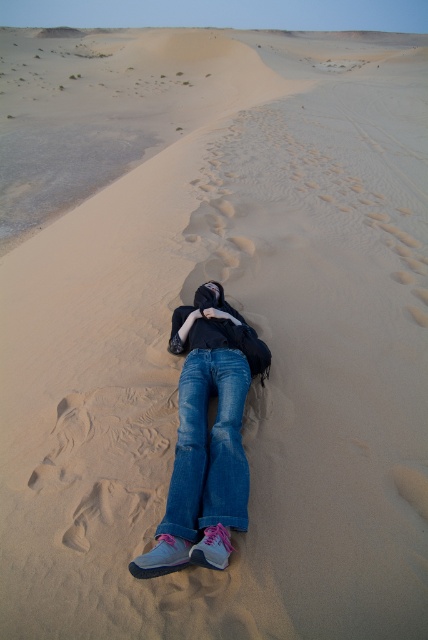
Question: Is blue denim jeans at center thinner than denim at center?

Choices:
 (A) yes
 (B) no

Answer: (B)

Question: Among these objects, which one is farthest from the camera?

Choices:
 (A) blue denim jeans at center
 (B) denim at center

Answer: (B)

Question: Which point is farther to the camera?

Choices:
 (A) (214, 349)
 (B) (265, 355)

Answer: (A)

Question: Does blue denim jeans at center come in front of denim at center?

Choices:
 (A) yes
 (B) no

Answer: (A)

Question: Which point is closer to the camera taking this photo?

Choices:
 (A) (238, 404)
 (B) (172, 492)

Answer: (B)

Question: Is blue denim jeans at center positioned before denim at center?

Choices:
 (A) yes
 (B) no

Answer: (A)